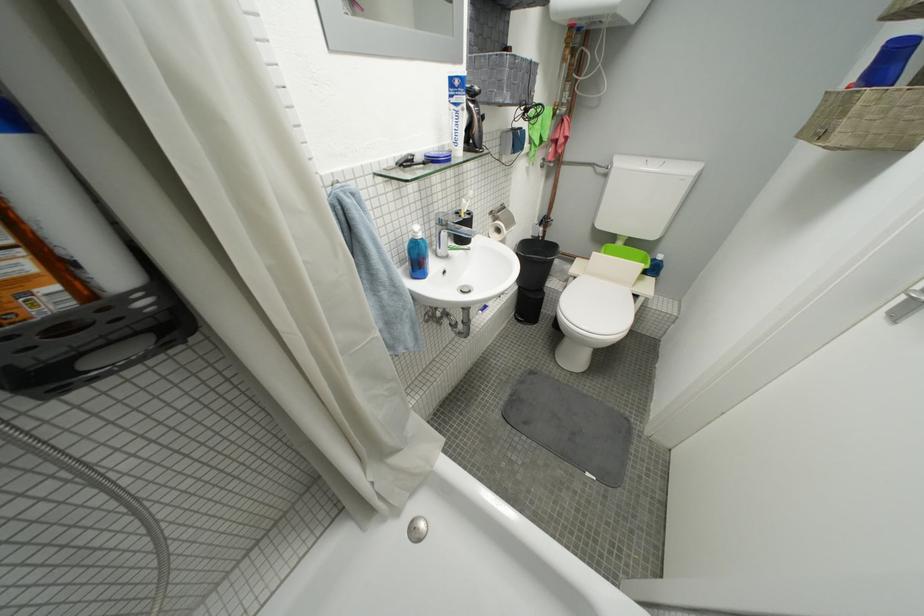
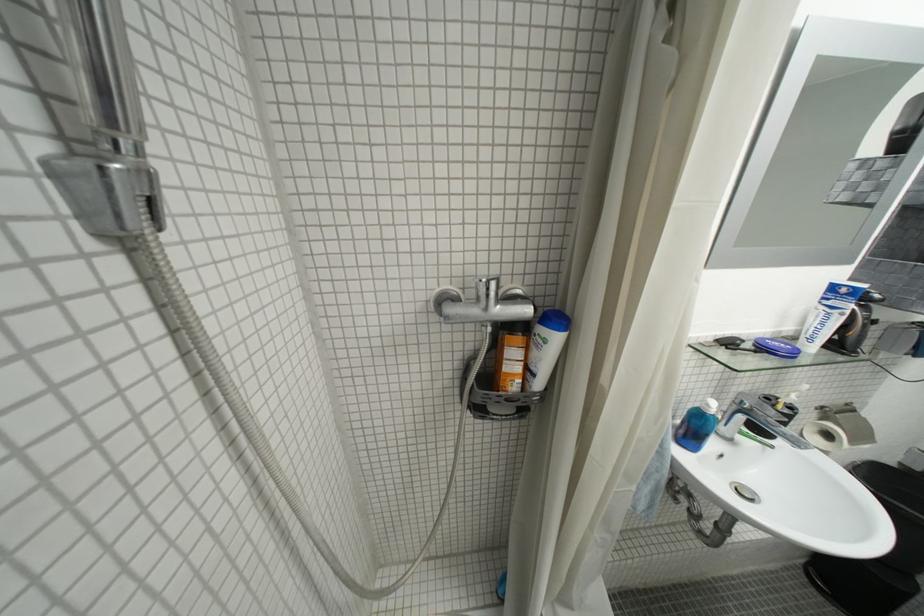
Where in the second image is the point corresponding to point 506,233 from the first image?

(836, 438)